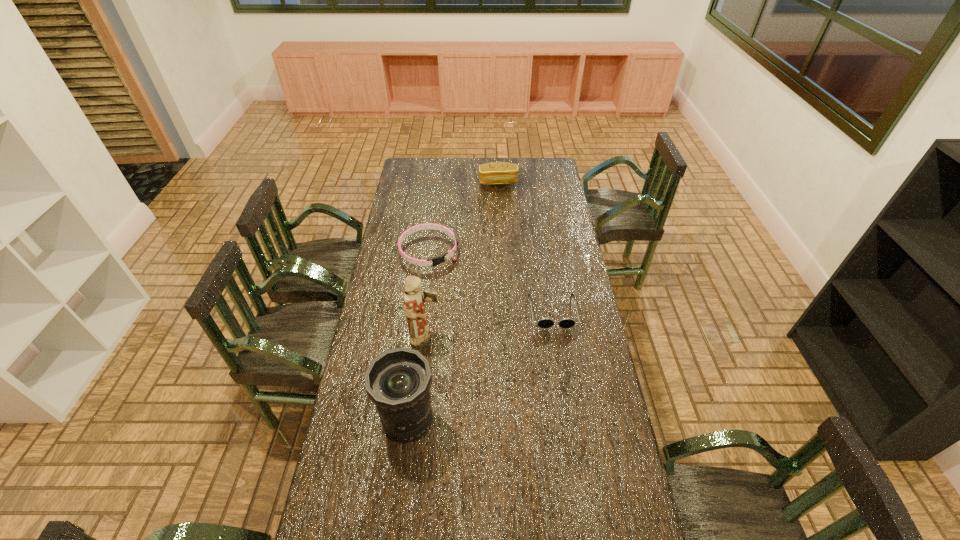
Locate an element on the screen. The image size is (960, 540). free spot on the desktop that is between the nearest object and the sunglasses and is positioned on the zipper side of the clutch bag is located at coordinates (508, 345).

Where is `vacant space on the desktop that is between the telephoto lens and the sunglasses and is positioned on the front-facing side of the figurine`? The width and height of the screenshot is (960, 540). vacant space on the desktop that is between the telephoto lens and the sunglasses and is positioned on the front-facing side of the figurine is located at coordinates [x=502, y=349].

This screenshot has width=960, height=540. In order to click on vacant space on the desktop that is between the telephoto lens and the sunglasses and is positioned with the buckle on the dog collar in this screenshot , I will do `click(500, 351)`.